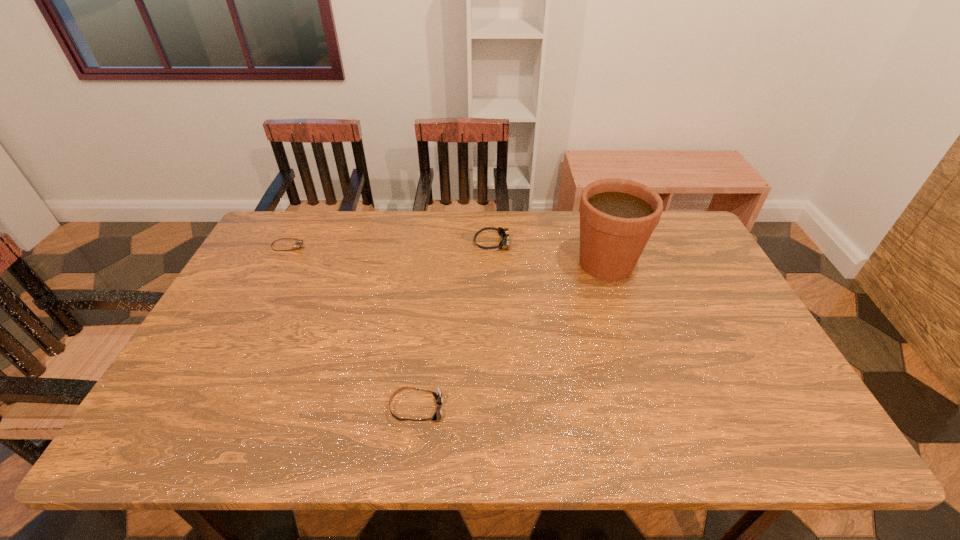
Locate an element on the screen. Image resolution: width=960 pixels, height=540 pixels. flowerpot is located at coordinates (617, 216).

Locate an element on the screen. This screenshot has height=540, width=960. the tallest object is located at coordinates (617, 216).

Locate an element on the screen. The image size is (960, 540). the second tallest object is located at coordinates (504, 233).

Identify the location of the rightmost goggles. (504, 233).

The width and height of the screenshot is (960, 540). I want to click on the second goggles from left to right, so click(438, 395).

Find the location of a particular element. The height and width of the screenshot is (540, 960). the third object from right to left is located at coordinates (438, 395).

The height and width of the screenshot is (540, 960). Find the location of `the shortest goggles`. the shortest goggles is located at coordinates (299, 243).

Locate an element on the screen. This screenshot has height=540, width=960. the leftmost object is located at coordinates (299, 243).

Where is `free space located on the front of the rightmost object`? The height and width of the screenshot is (540, 960). free space located on the front of the rightmost object is located at coordinates pos(633,343).

At what (x,y) coordinates should I click in order to perform the action: click on vacant region located through the lenses of the rightmost goggles. Please return your answer as a coordinate pair (x, y). Looking at the image, I should click on (414, 243).